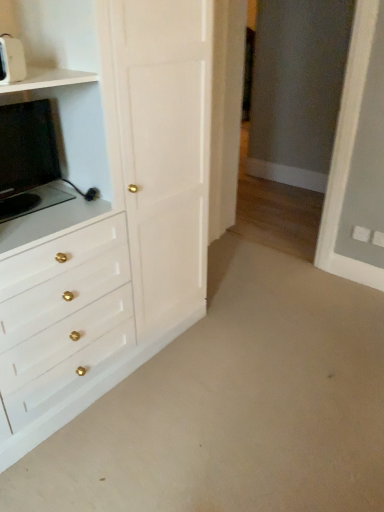
Describe the element at coordinates (112, 203) in the screenshot. I see `white glossy chest of drawers at left` at that location.

Where is `matte black tv at left, marked as the second appliance in a front-to-back arrangement`? This screenshot has height=512, width=384. matte black tv at left, marked as the second appliance in a front-to-back arrangement is located at coordinates (28, 159).

Looking at this image, from the image's perspective, which one is positioned lower, matte black tv at left, marked as the second appliance in a front-to-back arrangement, or white glossy chest of drawers at left?

white glossy chest of drawers at left is shown below in the image.

Does matte black tv at left, marked as the second appliance in a front-to-back arrangement, appear on the left side of white glossy chest of drawers at left?

Correct, you'll find matte black tv at left, marked as the second appliance in a front-to-back arrangement, to the left of white glossy chest of drawers at left.

Considering the positions of points (2, 112) and (128, 319), is point (2, 112) farther from camera compared to point (128, 319)?

That is False.

Is matte black tv at left, marked as the 1th appliance in a back-to-front arrangement, with white glossy chest of drawers at left?

No, matte black tv at left, marked as the 1th appliance in a back-to-front arrangement, is not beside white glossy chest of drawers at left.

From the picture: Which of these two, white glossy chest of drawers at left or white plastic toaster at upper left, the second appliance when ordered from back to front, is thinner?

white plastic toaster at upper left, the second appliance when ordered from back to front, is thinner.

Is white glossy chest of drawers at left aimed at white plastic toaster at upper left, the second appliance when ordered from back to front?

Yes.

Considering the positions of point (57, 55) and point (10, 42), is point (57, 55) closer or farther from the camera than point (10, 42)?

Point (57, 55).

From the image's perspective, does white glossy chest of drawers at left appear higher than white plastic toaster at upper left, the second appliance when ordered from back to front?

No, from the image's perspective, white glossy chest of drawers at left is not over white plastic toaster at upper left, the second appliance when ordered from back to front.

Does white plastic toaster at upper left, the second appliance when ordered from back to front, turn towards matte black tv at left, marked as the 1th appliance in a back-to-front arrangement?

No, white plastic toaster at upper left, the second appliance when ordered from back to front, does not turn towards matte black tv at left, marked as the 1th appliance in a back-to-front arrangement.

From the image's perspective, who appears lower, white plastic toaster at upper left, the second appliance when ordered from back to front, or matte black tv at left, marked as the 1th appliance in a back-to-front arrangement?

From the image's view, matte black tv at left, marked as the 1th appliance in a back-to-front arrangement, is below.

Consider the image. Considering the relative sizes of white plastic toaster at upper left, the second appliance when ordered from back to front, and matte black tv at left, marked as the second appliance in a front-to-back arrangement, in the image provided, is white plastic toaster at upper left, the second appliance when ordered from back to front, thinner than matte black tv at left, marked as the second appliance in a front-to-back arrangement,?

Yes, white plastic toaster at upper left, the second appliance when ordered from back to front, is thinner than matte black tv at left, marked as the second appliance in a front-to-back arrangement.

Is white glossy chest of drawers at left directly adjacent to matte black tv at left, marked as the 1th appliance in a back-to-front arrangement?

No, white glossy chest of drawers at left is not making contact with matte black tv at left, marked as the 1th appliance in a back-to-front arrangement.

Does white glossy chest of drawers at left appear on the right side of matte black tv at left, marked as the second appliance in a front-to-back arrangement?

Correct, you'll find white glossy chest of drawers at left to the right of matte black tv at left, marked as the second appliance in a front-to-back arrangement.

Is white glossy chest of drawers at left wider than matte black tv at left, marked as the second appliance in a front-to-back arrangement?

Correct, the width of white glossy chest of drawers at left exceeds that of matte black tv at left, marked as the second appliance in a front-to-back arrangement.

Is white glossy chest of drawers at left further to camera compared to matte black tv at left, marked as the 1th appliance in a back-to-front arrangement?

No, the depth of white glossy chest of drawers at left is less than that of matte black tv at left, marked as the 1th appliance in a back-to-front arrangement.

Find the location of a particular element. The width and height of the screenshot is (384, 512). appliance that appears below the white plastic toaster at upper left, placed as the first appliance when sorted from front to back (from the image's perspective) is located at coordinates (28, 159).

Does matte black tv at left, marked as the second appliance in a front-to-back arrangement, lie in front of white plastic toaster at upper left, the second appliance when ordered from back to front?

No.

Between matte black tv at left, marked as the 1th appliance in a back-to-front arrangement, and white plastic toaster at upper left, placed as the first appliance when sorted from front to back, which one has smaller width?

Thinner between the two is white plastic toaster at upper left, placed as the first appliance when sorted from front to back.

Based on the photo, considering the positions of objects matte black tv at left, marked as the second appliance in a front-to-back arrangement, and white plastic toaster at upper left, placed as the first appliance when sorted from front to back, in the image provided, who is more to the left, matte black tv at left, marked as the second appliance in a front-to-back arrangement, or white plastic toaster at upper left, placed as the first appliance when sorted from front to back,?

matte black tv at left, marked as the second appliance in a front-to-back arrangement.

Could you tell me if white plastic toaster at upper left, placed as the first appliance when sorted from front to back, is facing white glossy chest of drawers at left?

Yes.

From a real-world perspective, is white plastic toaster at upper left, the second appliance when ordered from back to front, physically above white glossy chest of drawers at left?

Yes, from a real-world perspective, white plastic toaster at upper left, the second appliance when ordered from back to front, is on top of white glossy chest of drawers at left.

Considering the relative sizes of white plastic toaster at upper left, the second appliance when ordered from back to front, and white glossy chest of drawers at left in the image provided, is white plastic toaster at upper left, the second appliance when ordered from back to front, smaller than white glossy chest of drawers at left?

Indeed, white plastic toaster at upper left, the second appliance when ordered from back to front, has a smaller size compared to white glossy chest of drawers at left.

Looking at this image, how many degrees apart are the facing directions of white plastic toaster at upper left, the second appliance when ordered from back to front, and white glossy chest of drawers at left?

white plastic toaster at upper left, the second appliance when ordered from back to front, and white glossy chest of drawers at left are facing 57.4 degrees away from each other.

Find the location of a particular element. The image size is (384, 512). chest of drawers located on the right of matte black tv at left, marked as the 1th appliance in a back-to-front arrangement is located at coordinates (112, 203).

Identify the location of the 2nd appliance above the white glossy chest of drawers at left (from the image's perspective). (11, 60).

Considering their positions, is white glossy chest of drawers at left positioned further to white plastic toaster at upper left, the second appliance when ordered from back to front, than matte black tv at left, marked as the 1th appliance in a back-to-front arrangement?

white glossy chest of drawers at left lies further to white plastic toaster at upper left, the second appliance when ordered from back to front, than the other object.

Based on their spatial positions, is white plastic toaster at upper left, placed as the first appliance when sorted from front to back, or matte black tv at left, marked as the second appliance in a front-to-back arrangement, further from white glossy chest of drawers at left?

Based on the image, white plastic toaster at upper left, placed as the first appliance when sorted from front to back, appears to be further to white glossy chest of drawers at left.

Which object lies nearer to the anchor point matte black tv at left, marked as the second appliance in a front-to-back arrangement, white plastic toaster at upper left, placed as the first appliance when sorted from front to back, or white glossy chest of drawers at left?

white glossy chest of drawers at left is closer to matte black tv at left, marked as the second appliance in a front-to-back arrangement.

From the image, which object appears to be farther from matte black tv at left, marked as the second appliance in a front-to-back arrangement, white glossy chest of drawers at left or white plastic toaster at upper left, the second appliance when ordered from back to front?

white plastic toaster at upper left, the second appliance when ordered from back to front, is positioned further to the anchor matte black tv at left, marked as the second appliance in a front-to-back arrangement.

Considering their positions, is matte black tv at left, marked as the 1th appliance in a back-to-front arrangement, positioned further to white plastic toaster at upper left, the second appliance when ordered from back to front, than white glossy chest of drawers at left?

white glossy chest of drawers at left is positioned further to the anchor white plastic toaster at upper left, the second appliance when ordered from back to front.

Which object lies further to the anchor point white glossy chest of drawers at left, matte black tv at left, marked as the second appliance in a front-to-back arrangement, or white plastic toaster at upper left, placed as the first appliance when sorted from front to back?

Based on the image, white plastic toaster at upper left, placed as the first appliance when sorted from front to back, appears to be further to white glossy chest of drawers at left.

The image size is (384, 512). Find the location of `appliance located between white glossy chest of drawers at left and matte black tv at left, marked as the second appliance in a front-to-back arrangement, in the depth direction`. appliance located between white glossy chest of drawers at left and matte black tv at left, marked as the second appliance in a front-to-back arrangement, in the depth direction is located at coordinates (11, 60).